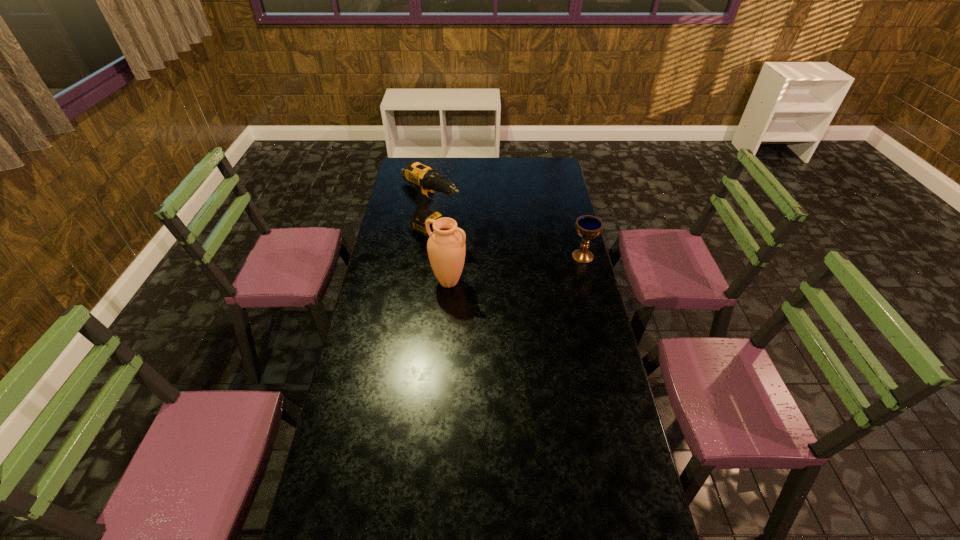
The image size is (960, 540). I want to click on object that stands as the second closest to the third nearest object, so click(x=401, y=171).

The width and height of the screenshot is (960, 540). Identify the location of free space that satisfies the following two spatial constraints: 1. on the front side of the second nearest object; 2. on the right side of the shortest object. (403, 255).

Image resolution: width=960 pixels, height=540 pixels. In order to click on free space that satisfies the following two spatial constraints: 1. on the front side of the second farthest object; 2. on the right side of the rightmost object in this screenshot , I will do `click(433, 255)`.

Where is `vacant space that satisfies the following two spatial constraints: 1. on the front side of the chalice; 2. on the left side of the shortest object`? vacant space that satisfies the following two spatial constraints: 1. on the front side of the chalice; 2. on the left side of the shortest object is located at coordinates (403, 255).

Where is `blank space that satisfies the following two spatial constraints: 1. on the front side of the shortest object; 2. on the left side of the urn`? blank space that satisfies the following two spatial constraints: 1. on the front side of the shortest object; 2. on the left side of the urn is located at coordinates (398, 282).